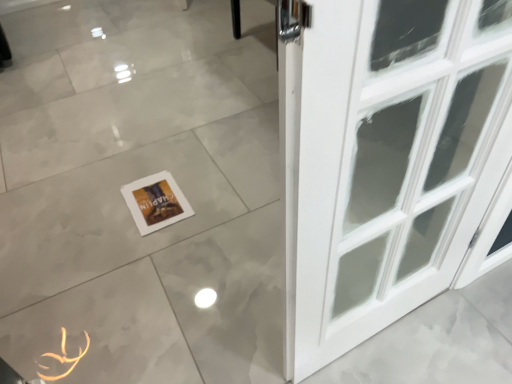
Question: Is the depth of white glossy tile at center less than that of white paper at lower center?

Choices:
 (A) yes
 (B) no

Answer: (A)

Question: Considering the relative positions of white glossy tile at center and white paper at lower center in the image provided, is white glossy tile at center to the left of white paper at lower center from the viewer's perspective?

Choices:
 (A) no
 (B) yes

Answer: (A)

Question: Does white glossy tile at center appear on the right side of white paper at lower center?

Choices:
 (A) yes
 (B) no

Answer: (A)

Question: Does white glossy tile at center have a lesser width compared to white paper at lower center?

Choices:
 (A) yes
 (B) no

Answer: (B)

Question: Is white glossy tile at center outside of white paper at lower center?

Choices:
 (A) no
 (B) yes

Answer: (B)

Question: Is white glossy tile at center in contact with white paper at lower center?

Choices:
 (A) yes
 (B) no

Answer: (B)

Question: Does white glossy tile at center appear on the left side of orange rubber band at lower left?

Choices:
 (A) yes
 (B) no

Answer: (B)

Question: From the image's perspective, is white glossy tile at center under orange rubber band at lower left?

Choices:
 (A) yes
 (B) no

Answer: (B)

Question: Does white glossy tile at center lie behind orange rubber band at lower left?

Choices:
 (A) no
 (B) yes

Answer: (A)

Question: Considering the relative sizes of white glossy tile at center and orange rubber band at lower left in the image provided, is white glossy tile at center taller than orange rubber band at lower left?

Choices:
 (A) yes
 (B) no

Answer: (A)

Question: Can you confirm if white glossy tile at center is smaller than orange rubber band at lower left?

Choices:
 (A) yes
 (B) no

Answer: (B)

Question: Is white glossy tile at center not inside orange rubber band at lower left?

Choices:
 (A) yes
 (B) no

Answer: (A)

Question: Is white paper at lower center to the left of orange rubber band at lower left from the viewer's perspective?

Choices:
 (A) no
 (B) yes

Answer: (A)